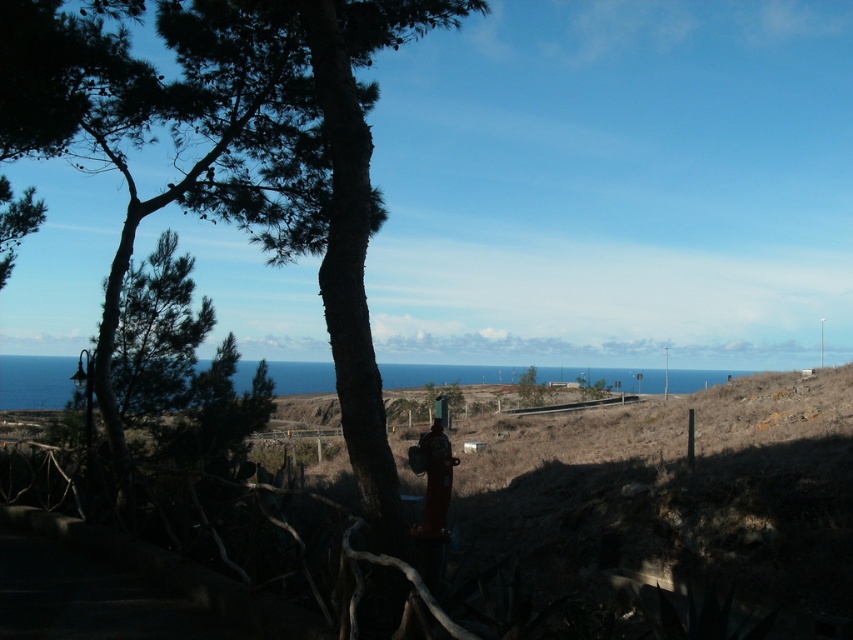
In the scene shown: You are a photographer aiming to capture a clear view of the green leafy tree at center without any obstructions. There is a matte brown jacket at center in the scene. Which object should you move to achieve an unobstructed view of the tree?

The matte brown jacket at center is positioned on the left side of the green leafy tree at center. To get a clear view of the green leafy tree at center without obstruction, you should move the matte brown jacket at center to the right side of the tree.

You are a photographer trying to capture the blue water at center and the matte brown jacket at center in your shot. Which object will appear taller in the photo?

The blue water at center will appear taller in the photo because it has a greater height compared to the matte brown jacket at center.